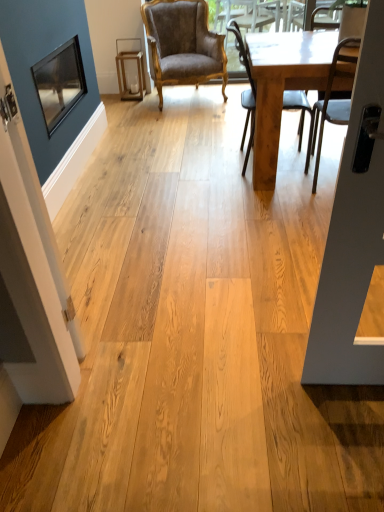
Where is `vacant area that lies between light brown wooden chair at center, arranged as the 2th chair when viewed from the front, and light brown wooden table at right`? vacant area that lies between light brown wooden chair at center, arranged as the 2th chair when viewed from the front, and light brown wooden table at right is located at coordinates (232, 177).